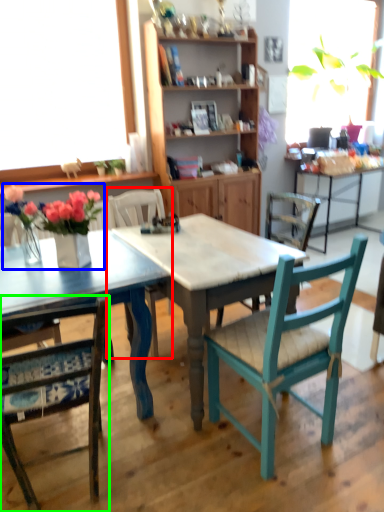
Question: Based on their relative distances, which object is farther from chair (highlighted by a red box)? Choose from floral arrangement (highlighted by a blue box) and chair (highlighted by a green box).

Choices:
 (A) floral arrangement
 (B) chair

Answer: (B)